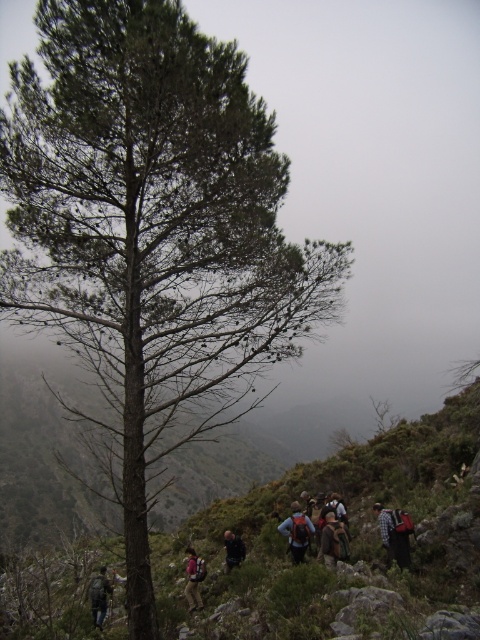
You are a hiker planning to place a small map case between the dark blue backpack at center and the plaid flannel shirt at lower right. Given that the map case is 1.2 meters wide, can you determine if there is enough space between them to fit it?

The dark blue backpack at center is wider than the plaid flannel shirt at lower right. However, the question of available space between them isn

You are a hiker trying to locate your friend who is wearing a plaid flannel shirt at lower right. You see a dark blue backpack at center. Which direction should you move to find your friend?

The dark blue backpack at center is positioned on the left side of plaid flannel shirt at lower right. To find your friend, move to the right from the dark blue backpack at center towards the plaid flannel shirt at lower right.

You are a hiker trying to keep up with your group. You notice the red backpack at lower right and the dark gray backpack at center. How far apart are these two backpacks?

The red backpack at lower right and dark gray backpack at center are 6.21 meters apart from each other.